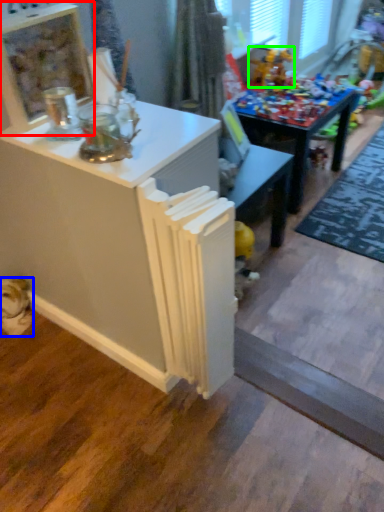
Question: Estimate the real-world distances between objects in this image. Which object is closer to shelf (highlighted by a red box), animal (highlighted by a blue box) or toy (highlighted by a green box)?

Choices:
 (A) animal
 (B) toy

Answer: (A)